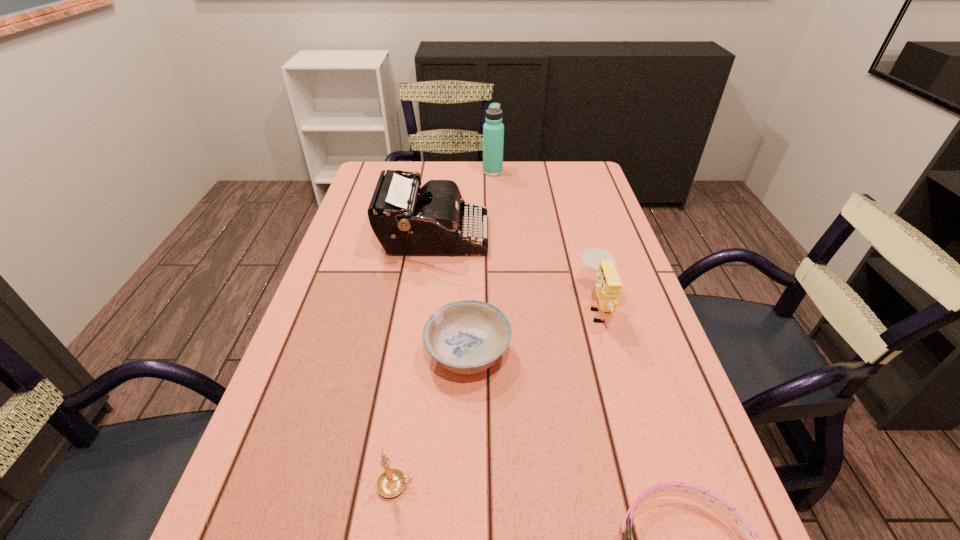
Where is `free space that is in between the bowl and the candle holder`? The height and width of the screenshot is (540, 960). free space that is in between the bowl and the candle holder is located at coordinates (432, 420).

Locate an element on the screen. This screenshot has height=540, width=960. the third closest object to the thermos bottle is located at coordinates (468, 336).

Identify which object is the second closest to the thermos bottle. Please provide its 2D coordinates. Your answer should be formatted as a tuple, i.e. [(x, y)], where the tuple contains the x and y coordinates of a point satisfying the conditions above.

[(608, 286)]

This screenshot has width=960, height=540. What are the coordinates of `free space that satisfies the following two spatial constraints: 1. on the typing side of the typewriter; 2. on the back side of the bowl` in the screenshot? It's located at (419, 354).